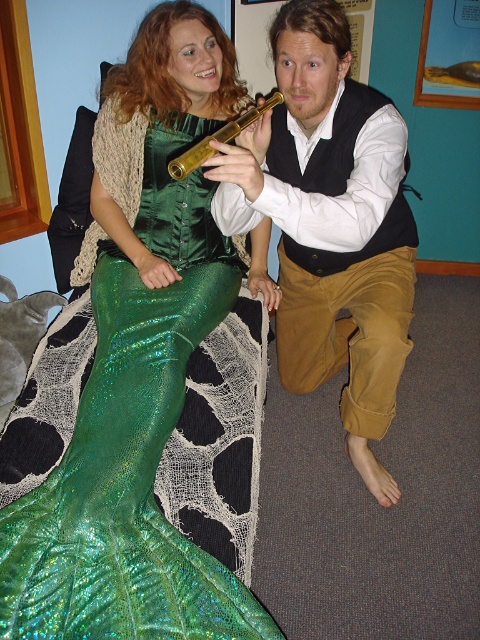
Does shiny green fabric at lower left have a larger size compared to matte black vest at center?

Actually, shiny green fabric at lower left might be smaller than matte black vest at center.

Which is more to the right, shiny green fabric at lower left or matte black vest at center?

matte black vest at center is more to the right.

Does point (137, 568) lie behind point (338, 216)?

No, (137, 568) is in front of (338, 216).

This screenshot has width=480, height=640. Find the location of `shiny green fabric at lower left`. shiny green fabric at lower left is located at coordinates (123, 486).